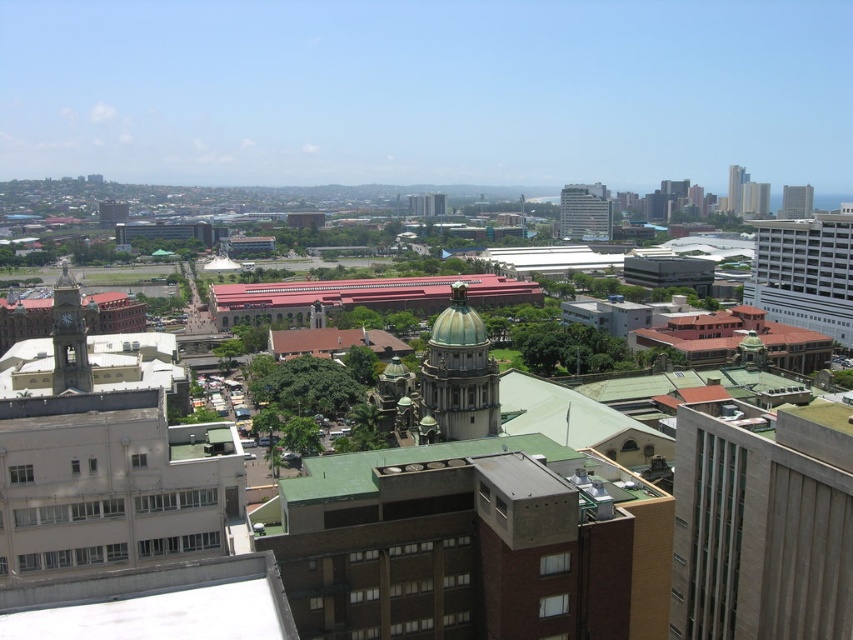
Locate an element on the screen. The width and height of the screenshot is (853, 640). matte gray clock tower at left is located at coordinates (68, 337).

Who is taller, matte gray clock tower at left or matte glass building at center?

Standing taller between the two is matte glass building at center.

This screenshot has width=853, height=640. I want to click on matte gray clock tower at left, so click(x=68, y=337).

Find the location of a particular element. The image size is (853, 640). matte gray clock tower at left is located at coordinates (68, 337).

Who is shorter, green dome building at center or glassy reflective skyscraper at upper right?

With less height is green dome building at center.

Which is behind, point (456, 301) or point (741, 209)?

The point (741, 209) is more distant.

The height and width of the screenshot is (640, 853). What do you see at coordinates (457, 376) in the screenshot? I see `green dome building at center` at bounding box center [457, 376].

Where is `green dome building at center`? This screenshot has width=853, height=640. green dome building at center is located at coordinates (457, 376).

From the picture: Does green dome building at center have a larger size compared to matte gray clock tower at left?

Correct, green dome building at center is larger in size than matte gray clock tower at left.

Is green dome building at center taller than matte gray clock tower at left?

Indeed, green dome building at center has a greater height compared to matte gray clock tower at left.

Is point (445, 406) closer to viewer compared to point (65, 296)?

Yes.

This screenshot has width=853, height=640. I want to click on green dome building at center, so click(x=457, y=376).